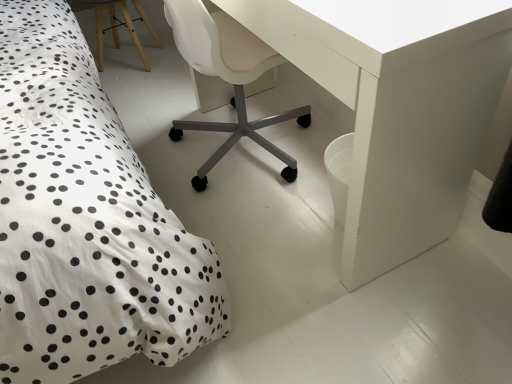
Where is `free space between white glossy table at center and white plastic chair at center`? free space between white glossy table at center and white plastic chair at center is located at coordinates (267, 220).